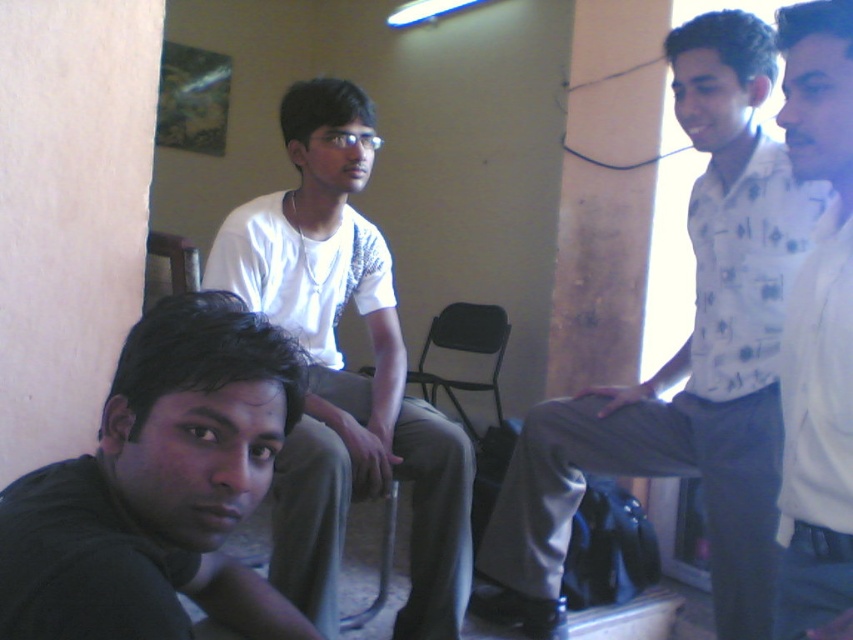
You are a photographer setting up a shoot in this room. You need to position a light source to the right of both the white printed shirt at upper right and the white matte shirt at upper right. Is this possible given their positions?

The white printed shirt at upper right is to the right of white matte shirt at upper right, so placing a light source to the right of both would require positioning it further to the right of the white printed shirt at upper right.